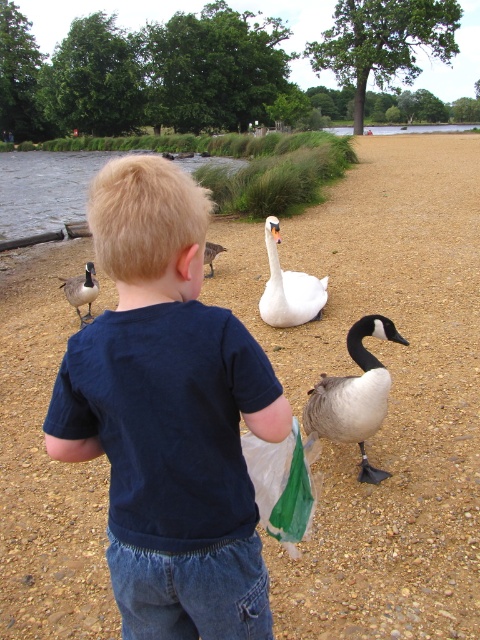
Who is more forward, (305,285) or (336,131)?

Point (305,285)

Does white glossy swan at center have a greater width compared to clear water at lower center?

No.

Which is behind, point (324, 301) or point (373, 125)?

The point (373, 125) is behind.

The image size is (480, 640). I want to click on white glossy swan at center, so click(288, 288).

Who is positioned more to the right, blue cotton shirt at center or brown speckled feathered goose at center?

brown speckled feathered goose at center is more to the right.

From the picture: Does blue cotton shirt at center lie behind brown speckled feathered goose at center?

No, blue cotton shirt at center is closer to the viewer.

Measure the distance between point (280, 413) and camera.

Point (280, 413) is 4.24 feet away from camera.

At what (x,y) coordinates should I click in order to perform the action: click on blue cotton shirt at center. Please return your answer as a coordinate pair (x, y). The width and height of the screenshot is (480, 640). Looking at the image, I should click on (168, 416).

Is brown speckled feathered goose at center closer to camera compared to clear water at lower center?

That is True.

Where is `brown speckled feathered goose at center`? brown speckled feathered goose at center is located at coordinates (355, 396).

Where is `brown speckled feathered goose at center`? The image size is (480, 640). brown speckled feathered goose at center is located at coordinates (355, 396).

Identify the location of brown speckled feathered goose at center. (355, 396).